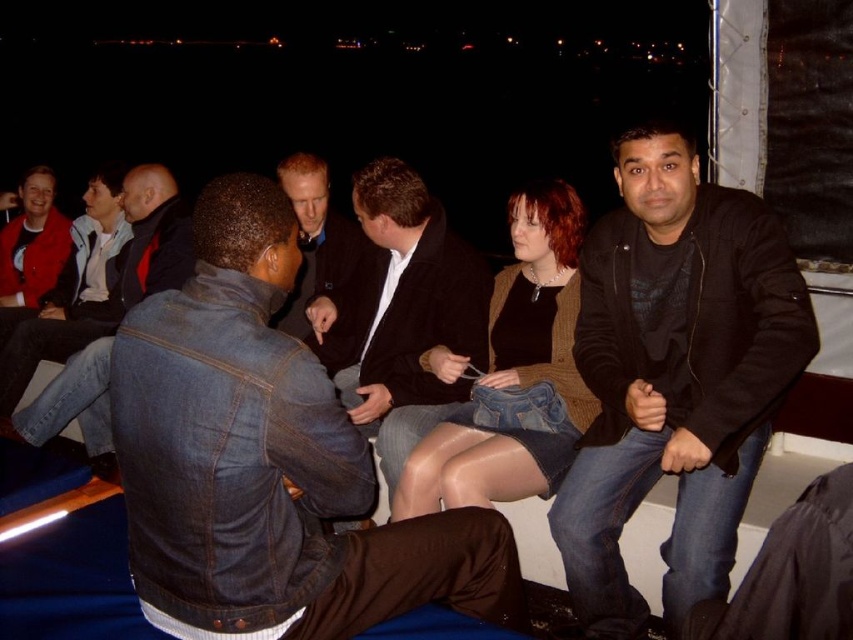
You are standing at the point labeled point [260,436] in the boat. You want to move to the point labeled point [693,577]. Which direction should you walk to reach your destination?

Since point [260,436] is in front of point [693,577], you should walk backward to reach point [693,577] from your current position.

You are standing in the boat and want to hand a drink to the person wearing the black leather jacket at right. Where should you look to find them?

The person wearing the black leather jacket at right is located at point (674,376) in the image coordinates, so you should look towards that coordinate to find them.

You are planning to sit between the black leather jacket at right and the matte red jacket at left. Which side should you choose if you want to have more space between you and the jackets?

The black leather jacket at right is wider than the matte red jacket at left, so choosing the side of the black leather jacket at right will provide more space between you and the jackets.